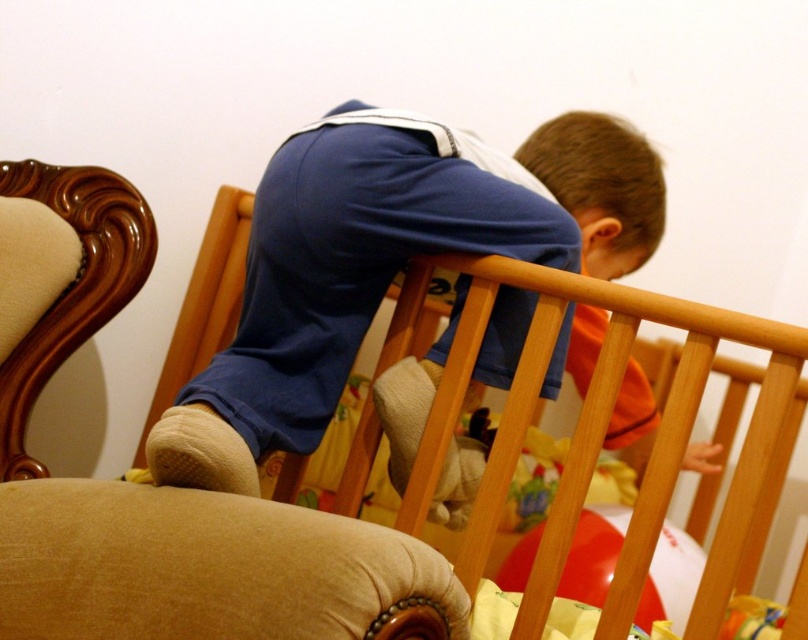
Question: In this image, where is blue cotton shirt at center located relative to wooden crib at upper center?

Choices:
 (A) right
 (B) left

Answer: (B)

Question: Is beige fabric armchair at left thinner than wooden crib at upper center?

Choices:
 (A) yes
 (B) no

Answer: (B)

Question: Which of the following is the closest to the observer?

Choices:
 (A) blue cotton shirt at center
 (B) beige fabric armchair at left

Answer: (B)

Question: Which point is farther to the camera?

Choices:
 (A) (7, 220)
 (B) (571, 518)
 (C) (609, 172)

Answer: (C)

Question: Does beige fabric armchair at left lie in front of wooden crib at upper center?

Choices:
 (A) yes
 (B) no

Answer: (A)

Question: Considering the real-world distances, which object is closest to the beige fabric armchair at left?

Choices:
 (A) blue cotton shirt at center
 (B) wooden crib at upper center

Answer: (B)